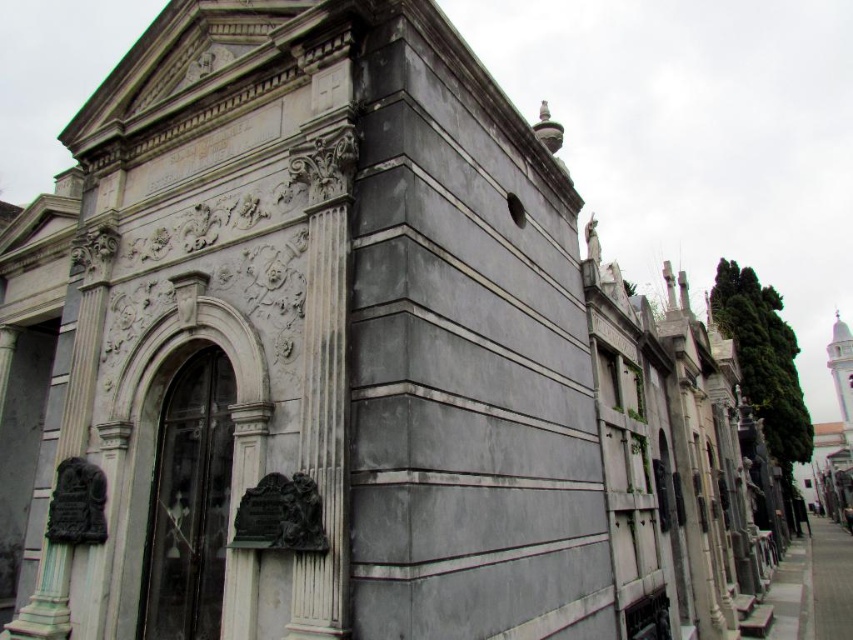
You are standing at the entrance of the cemetery and want to locate the gray marble statue at center. Based on the coordinates provided, in which direction should you walk from the entrance to find it?

The gray marble statue at center is located at coordinates point (466, 360), which means it is positioned slightly to the right and just below the center of the image. From the entrance, you should walk forward towards the center and slightly to the right to reach it.

From the picture: You are a visitor at the cemetery and want to take a photo of the gray marble statue at center and the white marble column at center. Which object should you focus on first if you want to capture both in a single frame without moving the camera?

The gray marble statue at center is much taller than the white marble column at center, so you should focus on the gray marble statue at center first to ensure it fits within the frame.

You are standing in front of the central mausoleum in the cemetery. You see a gray marble statue at center and a white marble column at center. Which object is located to the right of the other?

The gray marble statue at center is positioned on the right side of white marble column at center.